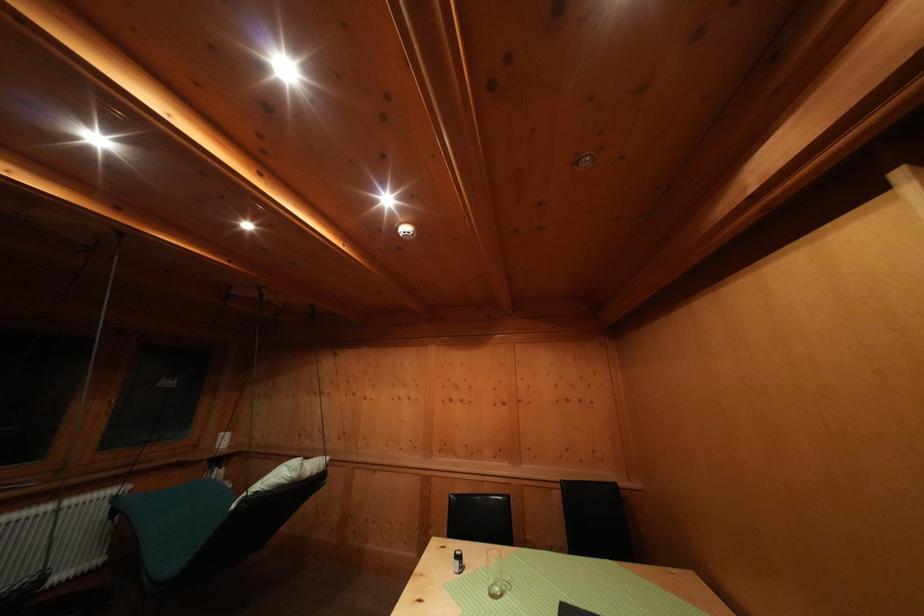
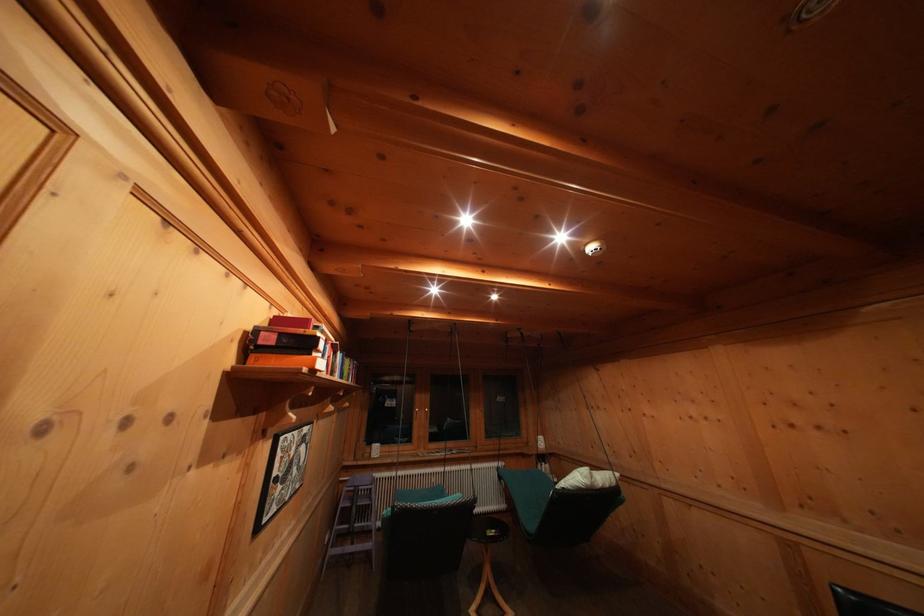
Find the pixel in the second image that matches (287,479) in the first image.

(584, 484)